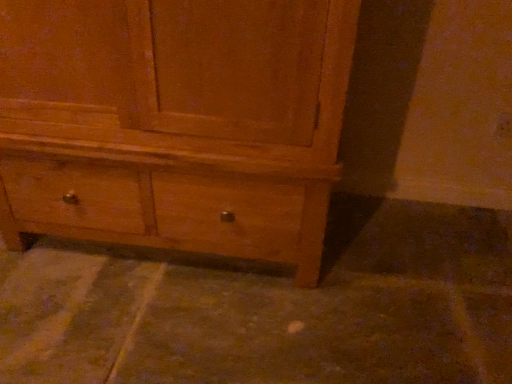
Question: Does point (444, 336) appear closer or farther from the camera than point (288, 152)?

Choices:
 (A) farther
 (B) closer

Answer: (A)

Question: Is brown concrete at lower center wider or thinner than matte wood chest of drawers at center?

Choices:
 (A) wide
 (B) thin

Answer: (A)

Question: Considering the positions of brown concrete at lower center and matte wood chest of drawers at center in the image, is brown concrete at lower center taller or shorter than matte wood chest of drawers at center?

Choices:
 (A) short
 (B) tall

Answer: (A)

Question: From the image's perspective, relative to brown concrete at lower center, is matte wood chest of drawers at center above or below?

Choices:
 (A) above
 (B) below

Answer: (A)

Question: Is matte wood chest of drawers at center spatially inside brown concrete at lower center, or outside of it?

Choices:
 (A) outside
 (B) inside

Answer: (A)

Question: Considering the positions of matte wood chest of drawers at center and brown concrete at lower center in the image, is matte wood chest of drawers at center wider or thinner than brown concrete at lower center?

Choices:
 (A) thin
 (B) wide

Answer: (A)

Question: Would you say matte wood chest of drawers at center is to the left or to the right of brown concrete at lower center in the picture?

Choices:
 (A) right
 (B) left

Answer: (B)